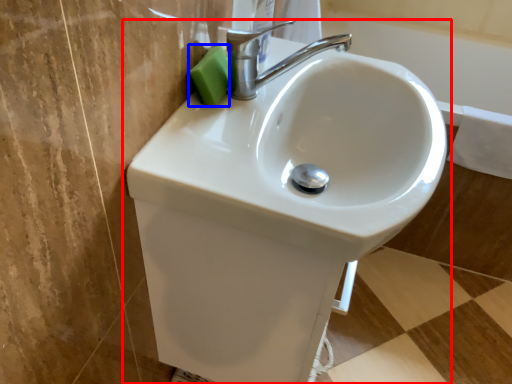
Question: Among these objects, which one is farthest to the camera, sink (highlighted by a red box) or soap (highlighted by a blue box)?

Choices:
 (A) sink
 (B) soap

Answer: (B)